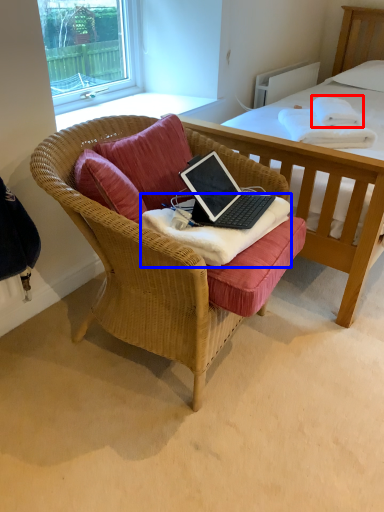
Question: Which object appears closest to the camera in this image, cloth (highlighted by a red box) or blanket (highlighted by a blue box)?

Choices:
 (A) cloth
 (B) blanket

Answer: (B)